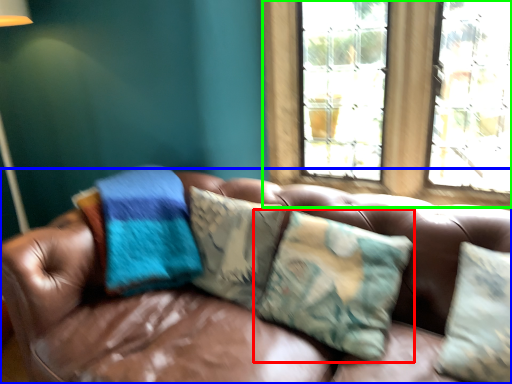
Question: Which object is positioned closest to pillow (highlighted by a red box)? Select from studio couch (highlighted by a blue box) and window (highlighted by a green box).

Choices:
 (A) studio couch
 (B) window

Answer: (A)